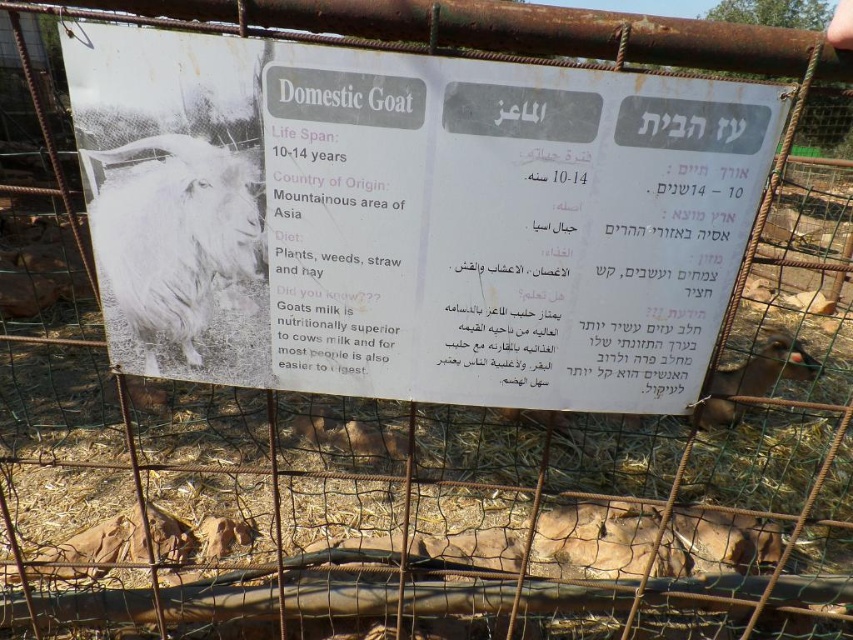
Is white paper sign at center shorter than brown furry goat at center?

No.

Can you confirm if white paper sign at center is positioned above brown furry goat at center?

Yes, white paper sign at center is above brown furry goat at center.

Which is behind, point (305, 330) or point (759, 388)?

Point (759, 388)

The width and height of the screenshot is (853, 640). Find the location of `white paper sign at center`. white paper sign at center is located at coordinates (503, 227).

Is white fluffy goat at upper left bigger than brown furry goat at center?

Incorrect, white fluffy goat at upper left is not larger than brown furry goat at center.

Which of these two, white fluffy goat at upper left or brown furry goat at center, stands shorter?

white fluffy goat at upper left is shorter.

Between point (238, 161) and point (709, 419), which one is positioned in front?

Point (238, 161) is in front.

Find the location of `white fluffy goat at upper left`. white fluffy goat at upper left is located at coordinates (178, 241).

Is white paper sign at center wider than white fluffy goat at upper left?

Yes, white paper sign at center is wider than white fluffy goat at upper left.

Does white paper sign at center appear over white fluffy goat at upper left?

Yes, white paper sign at center is above white fluffy goat at upper left.

Between point (408, 77) and point (201, 320), which one is positioned behind?

Point (201, 320)

Where is `white paper sign at center`? white paper sign at center is located at coordinates (503, 227).